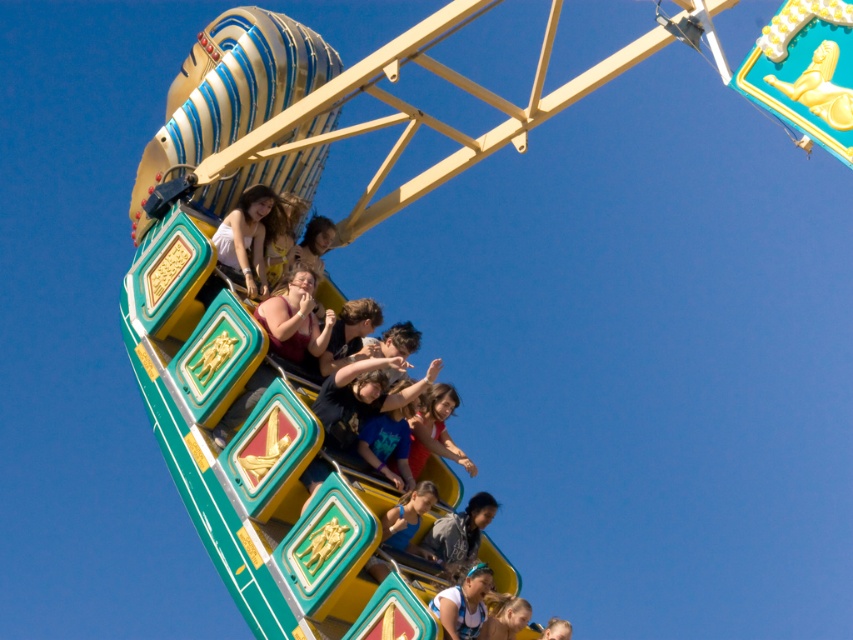
Question: Can you confirm if gray fabric shirt at center is positioned to the right of matte blue hair at lower center?

Choices:
 (A) no
 (B) yes

Answer: (A)

Question: Does gray fabric shirt at center appear on the right side of matte blue hair at lower center?

Choices:
 (A) yes
 (B) no

Answer: (B)

Question: Which of the following is the farthest from the observer?

Choices:
 (A) (554, 618)
 (B) (374, 490)

Answer: (A)

Question: Does matte black shirt at center lie behind matte blue hair at lower center?

Choices:
 (A) yes
 (B) no

Answer: (B)

Question: Which point is farther to the camera?

Choices:
 (A) (503, 621)
 (B) (438, 566)
 (C) (553, 628)

Answer: (C)

Question: Estimate the real-world distances between objects in this image. Which object is closer to the light brown hair at lower center?

Choices:
 (A) matte maroon shirt at center
 (B) matte blue hair at lower center
 (C) matte black shirt at center

Answer: (B)